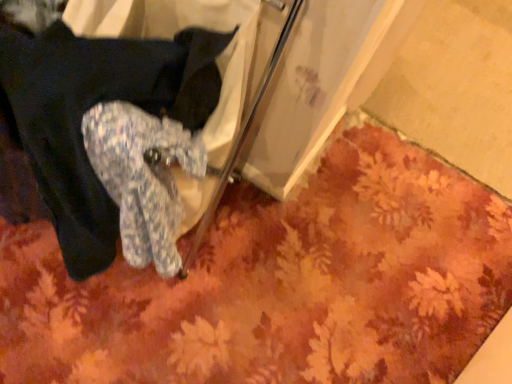
Question: Is floral carpet at lower center inside or outside of fluffy blue socks at lower left?

Choices:
 (A) inside
 (B) outside

Answer: (B)

Question: Considering the positions of floral carpet at lower center and fluffy blue socks at lower left in the image, is floral carpet at lower center wider or thinner than fluffy blue socks at lower left?

Choices:
 (A) wide
 (B) thin

Answer: (A)

Question: Is floral carpet at lower center in front of or behind fluffy blue socks at lower left in the image?

Choices:
 (A) front
 (B) behind

Answer: (B)

Question: Is fluffy blue socks at lower left inside or outside of floral carpet at lower center?

Choices:
 (A) inside
 (B) outside

Answer: (B)

Question: Is point (175, 64) positioned closer to the camera than point (389, 241)?

Choices:
 (A) closer
 (B) farther

Answer: (A)

Question: From a real-world perspective, relative to floral carpet at lower center, is fluffy blue socks at lower left vertically above or below?

Choices:
 (A) below
 (B) above

Answer: (B)

Question: In the image, is fluffy blue socks at lower left on the left side or the right side of floral carpet at lower center?

Choices:
 (A) right
 (B) left

Answer: (B)